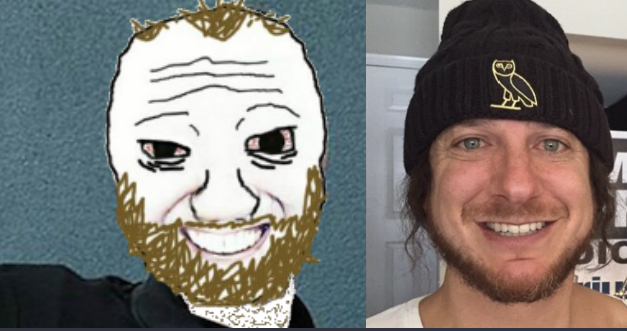
Identify the location of poster. (604, 61).